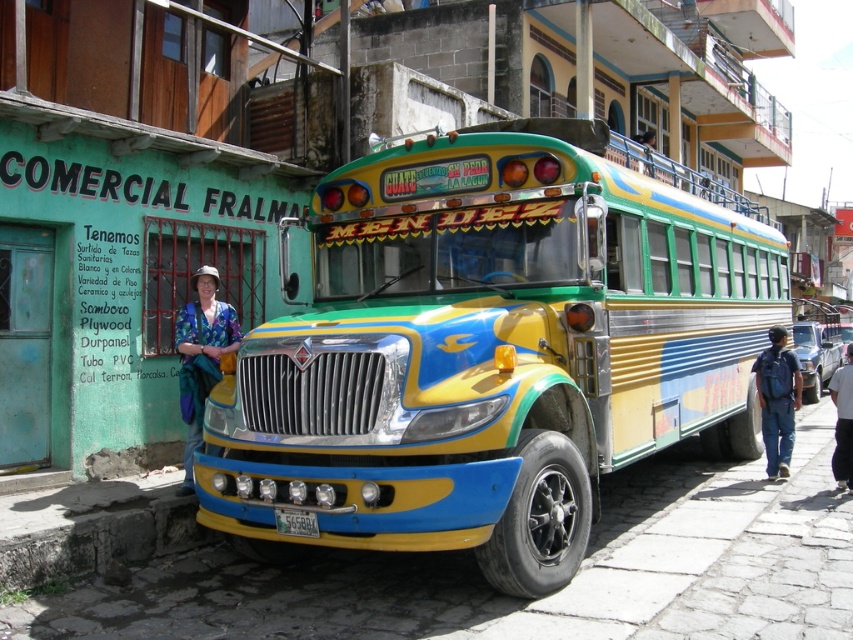
From the picture: You are standing on the cobblestone street looking at the scene. You see the concrete at lower left and the black fabric pants at lower right. Which object is positioned to the left of the other?

The concrete at lower left is to the left of the black fabric pants at lower right.

You are standing on the cobblestone street and see the concrete at lower left and blue jeans at lower right. Which object is positioned to the left of the other?

The concrete at lower left is to the left of blue jeans at lower right.

You are standing at the lower left corner of the image. You want to place a small potted plant on the concrete at lower left. Where exactly should you place it?

You should place the small potted plant at point [100,538] on the concrete at lower left.